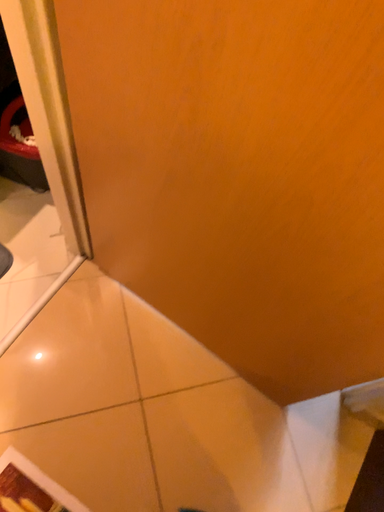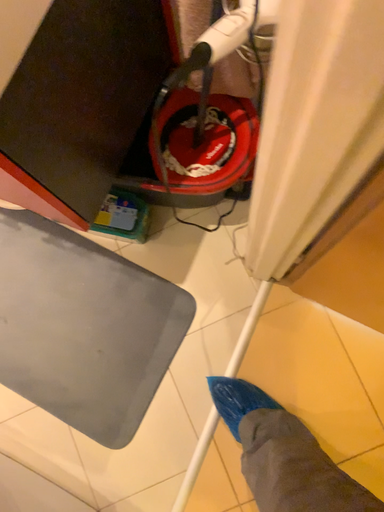
Question: How did the camera likely rotate when shooting the video?

Choices:
 (A) rotated downward
 (B) rotated upward

Answer: (A)